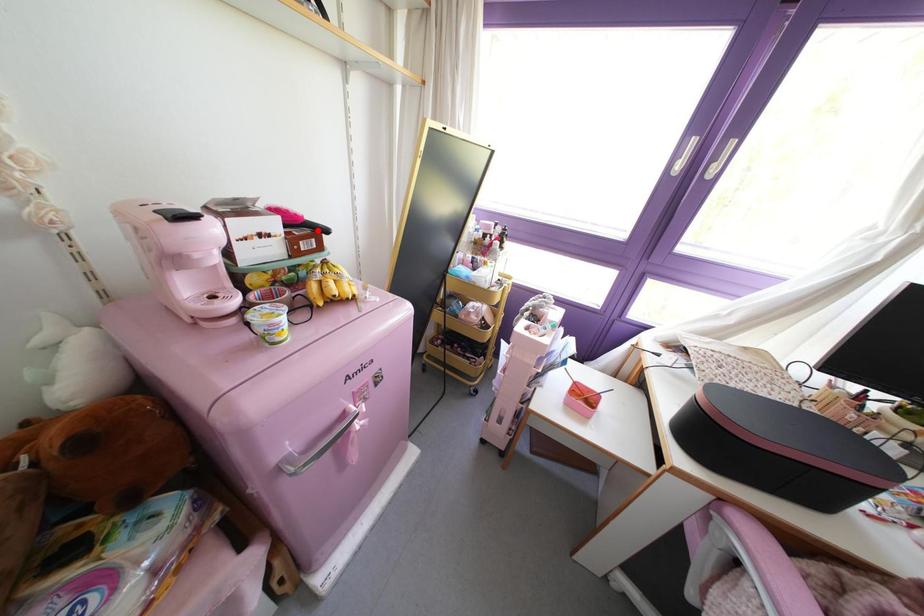
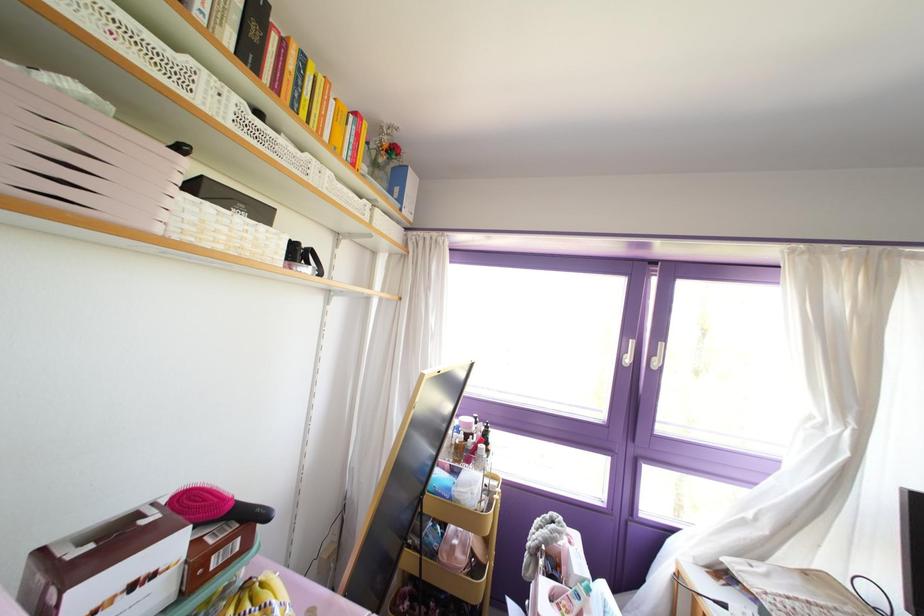
Question: I am providing you with two images of the same scene from different viewpoints. In image1, a red point is highlighted. Considering the same 3D point in image2, which of the following is correct?

Choices:
 (A) It is closer
 (B) It is farther

Answer: (B)